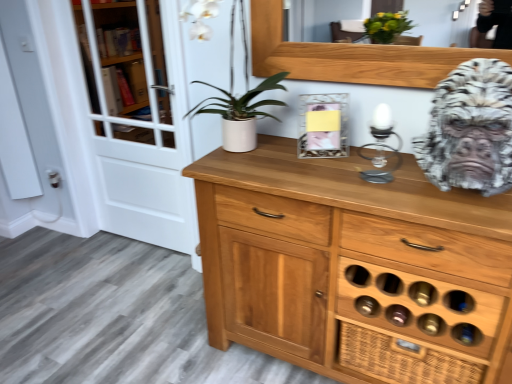
Question: Is point (397, 165) positioned closer to the camera than point (104, 223)?

Choices:
 (A) farther
 (B) closer

Answer: (B)

Question: Is clear glass candle holder at center taller or shorter than white glass screen door at left?

Choices:
 (A) short
 (B) tall

Answer: (A)

Question: Estimate the real-world distances between objects in this image. Which object is farther from the white marble gorilla head at right?

Choices:
 (A) white glass screen door at left
 (B) white matte pot at center
 (C) clear glass candle holder at center

Answer: (A)

Question: Which of these objects is positioned farthest from the white glass screen door at left?

Choices:
 (A) clear glass candle holder at center
 (B) white marble gorilla head at right
 (C) white matte pot at center

Answer: (B)